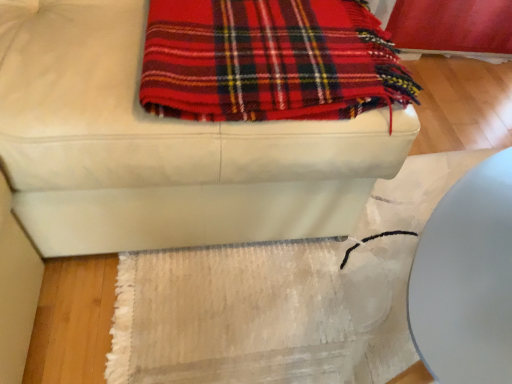
What is the approximate width of white leather ottoman at upper center?

The width of white leather ottoman at upper center is 3.62 feet.

Find the location of a particular element. The width and height of the screenshot is (512, 384). red plaid blanket at upper center is located at coordinates (269, 61).

Between white textured mat at lower center and white leather ottoman at upper center, which one has larger width?

white leather ottoman at upper center.

Does white textured mat at lower center have a lesser height compared to white leather ottoman at upper center?

Yes.

Is white textured mat at lower center with white leather ottoman at upper center?

No.

In the scene shown: From a real-world perspective, is white textured mat at lower center positioned above or below white leather ottoman at upper center?

From a real-world perspective, white textured mat at lower center is physically below white leather ottoman at upper center.

Is red plaid blanket at upper center facing away from white textured mat at lower center?

No, red plaid blanket at upper center's orientation is not away from white textured mat at lower center.

Locate an element on the screen. blanket on the left of white textured mat at lower center is located at coordinates (269, 61).

Considering the sizes of objects red plaid blanket at upper center and white textured mat at lower center in the image provided, who is wider, red plaid blanket at upper center or white textured mat at lower center?

Wider between the two is white textured mat at lower center.

Measure the distance from red plaid blanket at upper center to white textured mat at lower center.

red plaid blanket at upper center and white textured mat at lower center are 18.40 inches apart from each other.

In the scene shown: Considering the sizes of objects red plaid blanket at upper center and white leather ottoman at upper center in the image provided, who is taller, red plaid blanket at upper center or white leather ottoman at upper center?

white leather ottoman at upper center is taller.

Is red plaid blanket at upper center inside the boundaries of white leather ottoman at upper center, or outside?

red plaid blanket at upper center is located inside white leather ottoman at upper center.

Which is more distant, (x=285, y=1) or (x=85, y=121)?

The point (x=285, y=1) is more distant.

Could you tell me if white leather ottoman at upper center is facing white textured mat at lower center?

No, white leather ottoman at upper center is not aimed at white textured mat at lower center.

From a real-world perspective, which object stands above the other?

white leather ottoman at upper center.

Relative to white textured mat at lower center, is white leather ottoman at upper center in front or behind?

Visually, white leather ottoman at upper center is located in front of white textured mat at lower center.

Between white leather ottoman at upper center and white textured mat at lower center, which one appears on the left side from the viewer's perspective?

From the viewer's perspective, white leather ottoman at upper center appears more on the left side.

Does point (173, 296) come farther from viewer compared to point (156, 11)?

Yes, point (173, 296) is farther from viewer.

From the image's perspective, is white textured mat at lower center above or below red plaid blanket at upper center?

Based on their image positions, white textured mat at lower center is located beneath red plaid blanket at upper center.

From a real-world perspective, is white textured mat at lower center on top of red plaid blanket at upper center?

No.

Considering the sizes of white textured mat at lower center and red plaid blanket at upper center in the image, is white textured mat at lower center taller or shorter than red plaid blanket at upper center?

Clearly, white textured mat at lower center is taller compared to red plaid blanket at upper center.

Which of these two, white leather ottoman at upper center or red plaid blanket at upper center, is smaller?

red plaid blanket at upper center is smaller.

Does white leather ottoman at upper center contain red plaid blanket at upper center?

That's correct, red plaid blanket at upper center is inside white leather ottoman at upper center.

Find the location of a particular element. blanket behind the white leather ottoman at upper center is located at coordinates (269, 61).

Does white leather ottoman at upper center have a lesser width compared to red plaid blanket at upper center?

No.

Locate an element on the screen. mat below the white leather ottoman at upper center (from the image's perspective) is located at coordinates (283, 298).

Find the location of a particular element. The image size is (512, 384). mat on the right of red plaid blanket at upper center is located at coordinates (283, 298).

From the image, which object appears to be farther from white textured mat at lower center, white leather ottoman at upper center or red plaid blanket at upper center?

red plaid blanket at upper center.

From the image, which object appears to be nearer to white textured mat at lower center, red plaid blanket at upper center or white leather ottoman at upper center?

white leather ottoman at upper center is closer to white textured mat at lower center.

From the image, which object appears to be nearer to red plaid blanket at upper center, white leather ottoman at upper center or white textured mat at lower center?

white leather ottoman at upper center lies closer to red plaid blanket at upper center than the other object.

Looking at the image, which one is located closer to white leather ottoman at upper center, white textured mat at lower center or red plaid blanket at upper center?

Based on the image, red plaid blanket at upper center appears to be nearer to white leather ottoman at upper center.

Looking at the image, which one is located closer to white leather ottoman at upper center, red plaid blanket at upper center or white textured mat at lower center?

red plaid blanket at upper center is closer to white leather ottoman at upper center.

When comparing their distances from red plaid blanket at upper center, does white textured mat at lower center or white leather ottoman at upper center seem closer?

white leather ottoman at upper center is positioned closer to the anchor red plaid blanket at upper center.

Where is `blanket situated between white leather ottoman at upper center and white textured mat at lower center from left to right`? This screenshot has width=512, height=384. blanket situated between white leather ottoman at upper center and white textured mat at lower center from left to right is located at coordinates (269, 61).